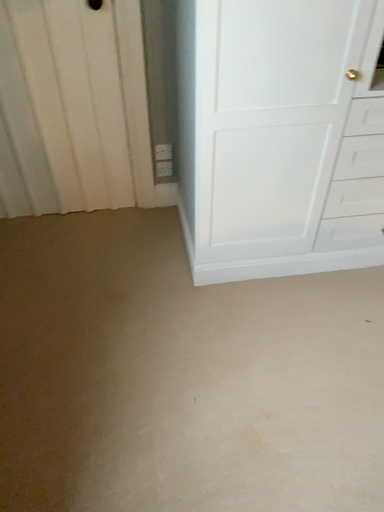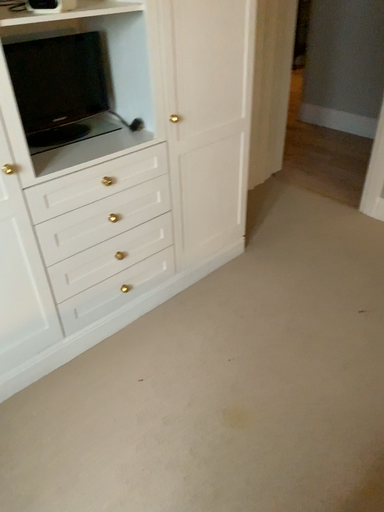
Question: Which way did the camera rotate in the video?

Choices:
 (A) rotated right
 (B) rotated left

Answer: (A)